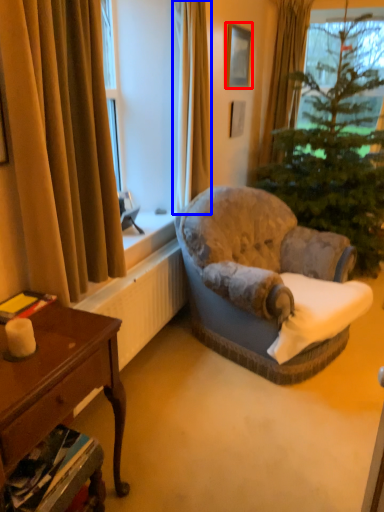
Question: Which of the following is the farthest to the observer, picture frame (highlighted by a red box) or curtain (highlighted by a blue box)?

Choices:
 (A) picture frame
 (B) curtain

Answer: (A)